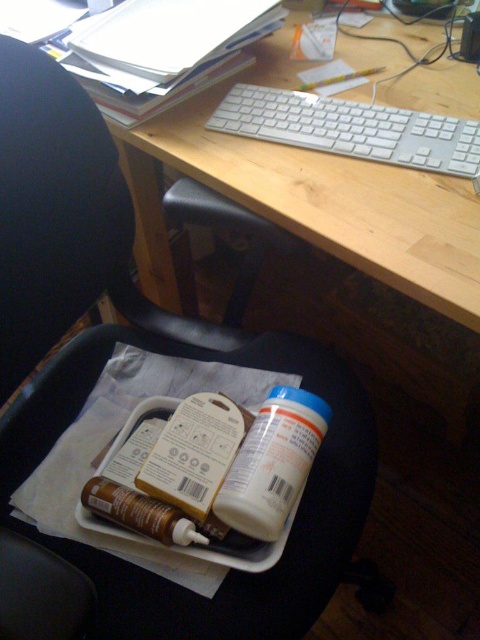
You are setting up a workstation and need to place a new monitor. The monitor requires at least 50 cm of vertical space between the top of the keyboard and the desk surface. Given the black plastic swivel chair at lower center and the white plastic keyboard at upper center, can you determine if there is enough space?

The black plastic swivel chair at lower center has a greater height compared to the white plastic keyboard at upper center. However, the exact height difference isn not provided, so it is impossible to confirm if the 50 cm requirement is met.

Based on the photo, you are setting up a new workstation and need to place a laptop between the black plastic swivel chair at lower center and the white plastic keyboard at upper center. Based on their positions, where should you place the laptop to ensure it is between them?

The black plastic swivel chair at lower center is positioned on the left side of white plastic keyboard at upper center. To place the laptop between them, position it to the right of the black plastic swivel chair at lower center and to the left of the white plastic keyboard at upper center.

You are setting up a workstation and need to place a new monitor. The monitor requires at least 10 cm of vertical space. Given the current setup with the wooden at upper center and the white plastic keyboard at upper center, is there enough vertical space between them to accommodate the monitor?

The wooden at upper center is taller than the white plastic keyboard at upper center. However, the exact vertical distance between them isn generated in the provided description. Without specific measurements, it is impossible to determine if there is enough space for the monitor.